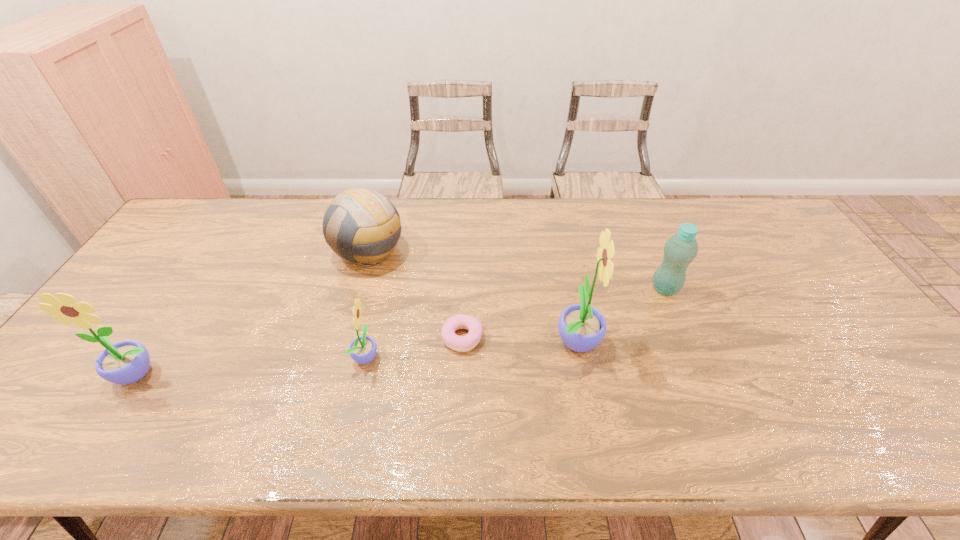
Where is `free space between the volleyball and the shortest object`? free space between the volleyball and the shortest object is located at coordinates (416, 294).

You are a GUI agent. You are given a task and a screenshot of the screen. Output one action in this format:
    pyautogui.click(x=<x>, y=<y>)
    Task: Click on the vacant space that's between the leftmost object and the fifth nearest object
    
    Given the screenshot: What is the action you would take?
    pyautogui.click(x=402, y=332)

Where is `vacant area that lies between the fourth object from left to right and the leftmost object`? The width and height of the screenshot is (960, 540). vacant area that lies between the fourth object from left to right and the leftmost object is located at coordinates (300, 356).

Identify the location of blank region between the shortest sunflower and the fifth nearest object. This screenshot has height=540, width=960. (516, 322).

Point out which object is positioned as the nearest to the rightmost sunflower. Please provide its 2D coordinates. Your answer should be formatted as a tuple, i.e. [(x, y)], where the tuple contains the x and y coordinates of a point satisfying the conditions above.

[(455, 342)]

Find the location of `object identified as the fifth closest to the water bottle`. object identified as the fifth closest to the water bottle is located at coordinates (126, 362).

Identify the location of the second closest sunflower to the second sunflower from right to left. This screenshot has width=960, height=540. coord(582,327).

You are a GUI agent. You are given a task and a screenshot of the screen. Output one action in this format:
    pyautogui.click(x=<x>, y=<y>)
    Task: Click on the sunflower identified as the second closest to the rightmost object
    The height and width of the screenshot is (540, 960).
    Given the screenshot: What is the action you would take?
    pyautogui.click(x=363, y=349)

In order to click on blank space that satisfies the following two spatial constraints: 1. at the front cap of the rightmost object; 2. on the front-facing side of the leftmost sunflower in this screenshot , I will do `click(702, 375)`.